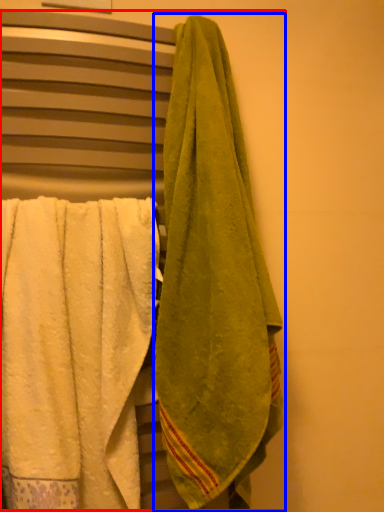
Question: Which of the following is the closest to the observer, laundry (highlighted by a red box) or towel (highlighted by a blue box)?

Choices:
 (A) laundry
 (B) towel

Answer: (B)